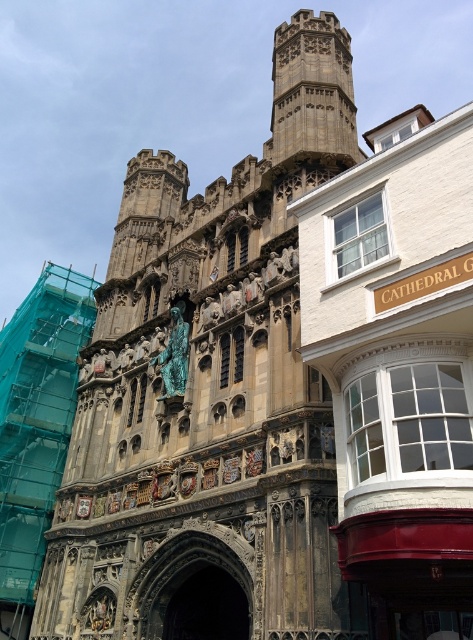
You are standing in front of the historic cathedral and want to take a photo of the stone tower at center. According to the coordinates provided, where should you position yourself to capture the tower in the frame?

The stone tower at center is located at point (209, 394), so you should position yourself directly in front of that coordinate to capture it in your photo.

You are an architect assessing the cathedral for preservation. You need to determine which object has a greater width between the stone tower at center and the gold metallic clock at center. Which one is wider?

The stone tower at center is wider than the gold metallic clock at center according to the description.

You are an architect visiting the cathedral. You need to install a new lighting system between the stone tower at center and the gold metallic clock at center. The cables can stretch up to 25 meters. Will the cables be sufficient?

The stone tower at center and gold metallic clock at center are 24.04 meters apart. Since the cables can stretch up to 25 meters, they will be sufficient to install the new lighting system between them.